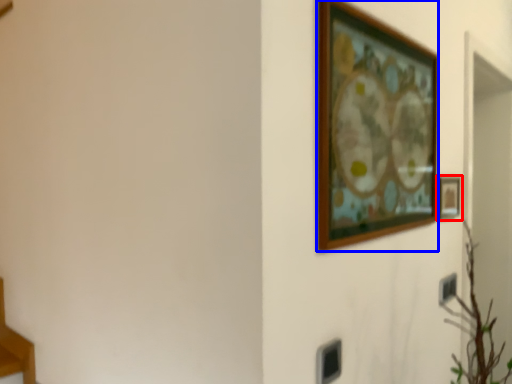
Question: Which point is further to the camera, picture frame (highlighted by a red box) or picture frame (highlighted by a blue box)?

Choices:
 (A) picture frame
 (B) picture frame

Answer: (A)